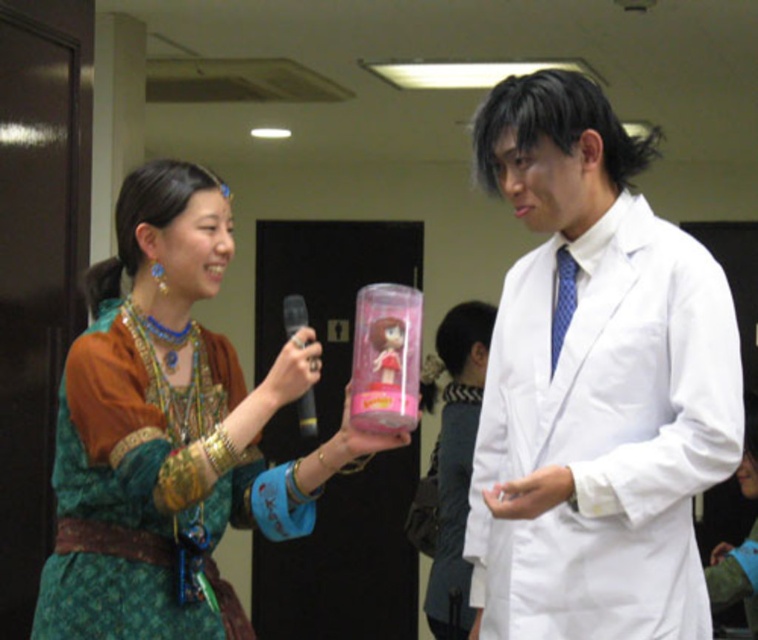
Is denim at right thinner than green velvet dress at lower right?

Correct, denim at right's width is less than green velvet dress at lower right's.

Does point (443, 563) come behind point (752, 586)?

Yes, it is.

Which is in front, point (445, 557) or point (753, 536)?

Point (753, 536)

Find the location of `denim at right`. denim at right is located at coordinates (450, 509).

Is white smooth lab coat at right bigger than denim at right?

Yes.

Who is more distant from viewer, [686,609] or [446,403]?

The point [446,403] is more distant.

Locate an element on the screen. The image size is (758, 640). white smooth lab coat at right is located at coordinates (594, 385).

Is matte green dress at center positioned before denim at right?

That is True.

Locate an element on the screen. The width and height of the screenshot is (758, 640). matte green dress at center is located at coordinates point(171,432).

You are a GUI agent. You are given a task and a screenshot of the screen. Output one action in this format:
    pyautogui.click(x=<x>, y=<y>)
    Task: Click on the matte green dress at center
    The width and height of the screenshot is (758, 640).
    Given the screenshot: What is the action you would take?
    pyautogui.click(x=171, y=432)

Locate an element on the screen. The width and height of the screenshot is (758, 640). matte green dress at center is located at coordinates (171, 432).